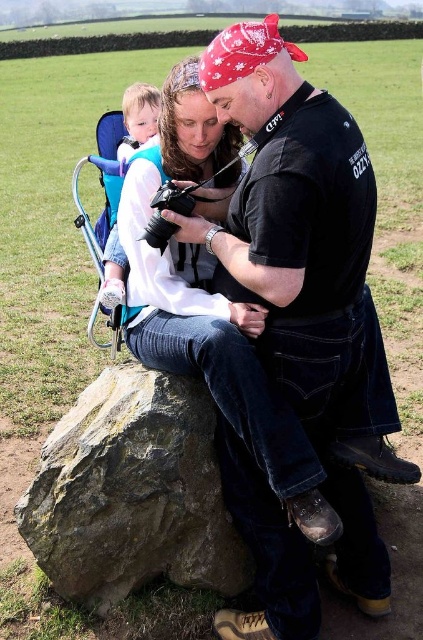
The image size is (423, 640). Describe the element at coordinates (131, 493) in the screenshot. I see `brown rough rock at center` at that location.

Looking at this image, does brown rough rock at center have a larger size compared to light blue fabric carrier at upper left?

Actually, brown rough rock at center might be smaller than light blue fabric carrier at upper left.

I want to click on brown rough rock at center, so click(131, 493).

The image size is (423, 640). Identify the location of brown rough rock at center. (131, 493).

Is black leather jacket at center below brown rough rock at center?

No, black leather jacket at center is not below brown rough rock at center.

Is black leather jacket at center further to camera compared to brown rough rock at center?

No, it is in front of brown rough rock at center.

Find the location of a particular element. black leather jacket at center is located at coordinates (294, 225).

The width and height of the screenshot is (423, 640). Find the location of `black leather jacket at center`. black leather jacket at center is located at coordinates (294, 225).

Does black leather jacket at center have a lesser width compared to light blue fabric carrier at upper left?

In fact, black leather jacket at center might be wider than light blue fabric carrier at upper left.

Can you confirm if black leather jacket at center is taller than light blue fabric carrier at upper left?

Indeed, black leather jacket at center has a greater height compared to light blue fabric carrier at upper left.

What do you see at coordinates (294, 225) in the screenshot? The width and height of the screenshot is (423, 640). I see `black leather jacket at center` at bounding box center [294, 225].

I want to click on black leather jacket at center, so (x=294, y=225).